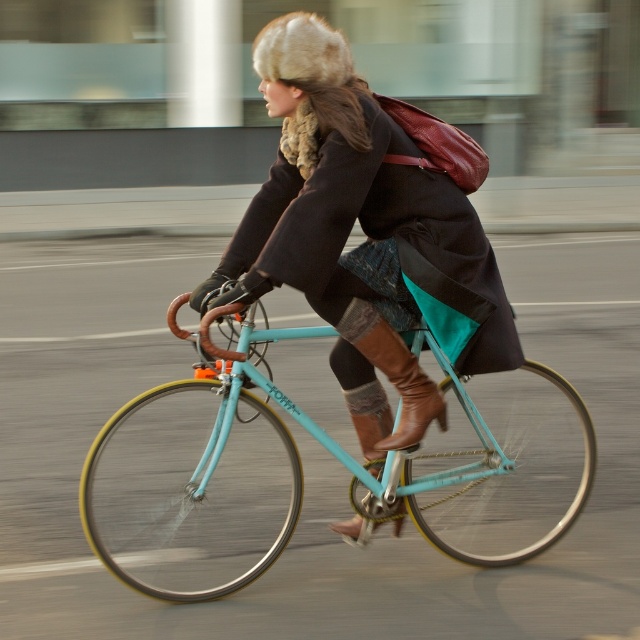
Question: Does teal matte bicycle at center have a smaller size compared to brown suede boot at center?

Choices:
 (A) yes
 (B) no

Answer: (B)

Question: Can you confirm if matte black coat at center is positioned below brown suede boot at center?

Choices:
 (A) no
 (B) yes

Answer: (A)

Question: Which is farther from the teal matte bicycle at center?

Choices:
 (A) matte black coat at center
 (B) brown suede boot at center

Answer: (B)

Question: Which object appears closest to the camera in this image?

Choices:
 (A) matte black coat at center
 (B) teal matte bicycle at center
 (C) brown suede boot at center

Answer: (B)

Question: Is brown leather boot at center above brown suede boot at center?

Choices:
 (A) no
 (B) yes

Answer: (B)

Question: Which of the following is the farthest from the observer?

Choices:
 (A) (371, 428)
 (B) (208, 483)

Answer: (B)